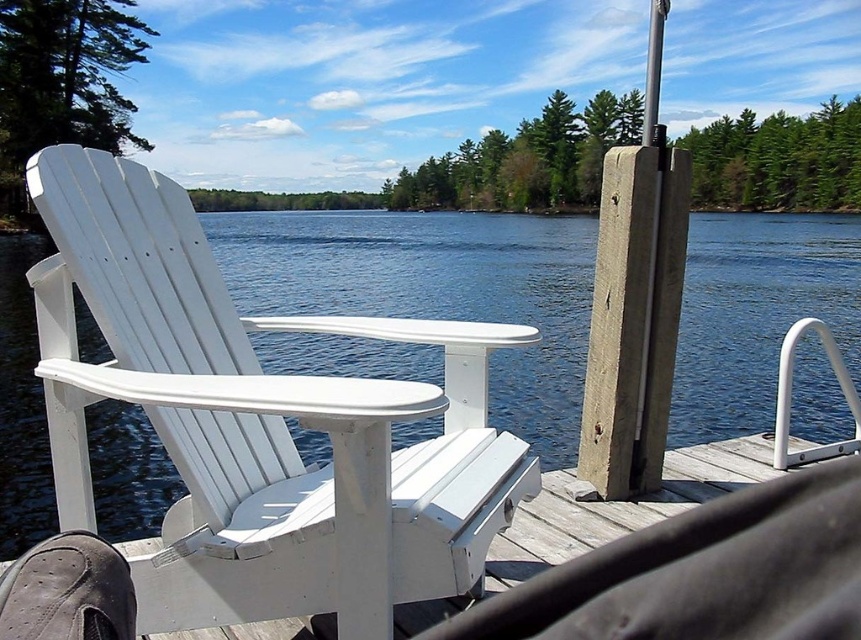
Does blue water at center appear on the right side of smooth gray pole at right?

Correct, you'll find blue water at center to the right of smooth gray pole at right.

Consider the image. Can you confirm if blue water at center is wider than smooth gray pole at right?

Indeed, blue water at center has a greater width compared to smooth gray pole at right.

Between point (770, 326) and point (640, 426), which one is positioned in front?

Point (640, 426)

Where is `blue water at center`? The height and width of the screenshot is (640, 861). blue water at center is located at coordinates (435, 291).

Between white wood deck at center and smooth gray pole at right, which one appears on the right side from the viewer's perspective?

Positioned to the right is smooth gray pole at right.

What do you see at coordinates (623, 506) in the screenshot? I see `white wood deck at center` at bounding box center [623, 506].

I want to click on white wood deck at center, so click(x=623, y=506).

Between white wood beach chair at left and blue water at center, which one has less height?

white wood beach chair at left is shorter.

Can you confirm if white wood beach chair at left is positioned below blue water at center?

Correct, white wood beach chair at left is located below blue water at center.

This screenshot has height=640, width=861. What do you see at coordinates (259, 422) in the screenshot?
I see `white wood beach chair at left` at bounding box center [259, 422].

This screenshot has width=861, height=640. I want to click on white wood beach chair at left, so click(x=259, y=422).